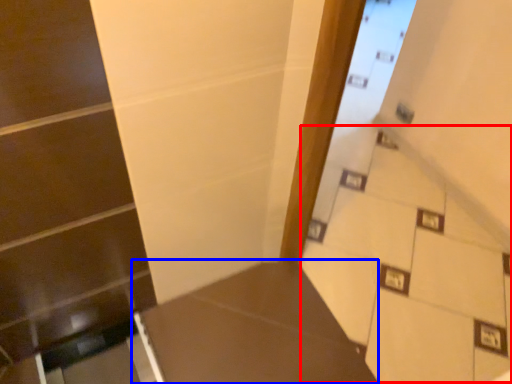
Question: Which object is closer to the camera taking this photo, stairwell (highlighted by a red box) or table (highlighted by a blue box)?

Choices:
 (A) stairwell
 (B) table

Answer: (A)